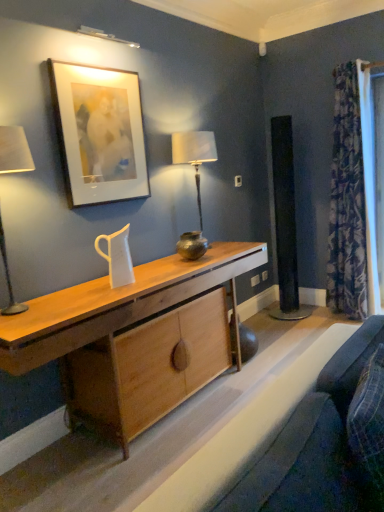
Measure the distance between matte white picture frame at upper left and camera.

matte white picture frame at upper left is 2.30 meters from camera.

The height and width of the screenshot is (512, 384). What do you see at coordinates (192, 245) in the screenshot?
I see `shiny metallic vase at center` at bounding box center [192, 245].

Find the location of `velvet blue swivel chair at lower right, the 2th swivel chair viewed from the right`. velvet blue swivel chair at lower right, the 2th swivel chair viewed from the right is located at coordinates (317, 446).

Describe the element at coordinates (347, 202) in the screenshot. I see `patterned fabric curtain at right` at that location.

What is the approximate width of natural wood desk at center?

It is 51.32 centimeters.

Describe the element at coordinates (361, 401) in the screenshot. I see `velvet blue cushion at lower right, the 2th swivel chair when ordered from left to right` at that location.

In order to click on metallic silver table lamp at center in this screenshot , I will do `click(195, 181)`.

Is velvet blue cushion at lower right, the 2th swivel chair when ordered from left to right, aimed at matte white picture frame at upper left?

No, velvet blue cushion at lower right, the 2th swivel chair when ordered from left to right, is not oriented towards matte white picture frame at upper left.

Does point (336, 358) appear closer or farther from the camera than point (114, 94)?

Clearly, point (336, 358) is closer to the camera than point (114, 94).

Between velvet blue cushion at lower right, the 2th swivel chair when ordered from left to right, and matte white picture frame at upper left, which one appears on the right side from the viewer's perspective?

velvet blue cushion at lower right, the 2th swivel chair when ordered from left to right.

Is velvet blue cushion at lower right, placed as the first swivel chair when sorted from right to left, bigger than matte white picture frame at upper left?

Indeed, velvet blue cushion at lower right, placed as the first swivel chair when sorted from right to left, has a larger size compared to matte white picture frame at upper left.

Find the location of a particular element. The width and height of the screenshot is (384, 512). table lamp above the velvet blue cushion at lower right, the 2th swivel chair when ordered from left to right (from the image's perspective) is located at coordinates (195, 181).

Which of these two, velvet blue cushion at lower right, the 2th swivel chair when ordered from left to right, or metallic silver table lamp at center, is wider?

metallic silver table lamp at center is wider.

From a real-world perspective, who is located higher, velvet blue cushion at lower right, placed as the first swivel chair when sorted from right to left, or metallic silver table lamp at center?

metallic silver table lamp at center, from a real-world perspective.

From the image's perspective, relative to natural wood desk at center, is patterned fabric curtain at right above or below?

Based on their image positions, patterned fabric curtain at right is located above natural wood desk at center.

How many degrees apart are the facing directions of patterned fabric curtain at right and natural wood desk at center?

The facing directions of patterned fabric curtain at right and natural wood desk at center are 89.5 degrees apart.

From their relative heights in the image, would you say patterned fabric curtain at right is taller or shorter than natural wood desk at center?

Considering their sizes, patterned fabric curtain at right has more height than natural wood desk at center.

From a real-world perspective, who is located higher, patterned fabric curtain at right or natural wood desk at center?

patterned fabric curtain at right.

Is shiny metallic vase at center positioned with its back to matte white picture frame at upper left?

That's not correct — shiny metallic vase at center is not looking away from matte white picture frame at upper left.

Which object is thinner, shiny metallic vase at center or matte white picture frame at upper left?

Thinner between the two is matte white picture frame at upper left.

Is shiny metallic vase at center positioned behind matte white picture frame at upper left?

Yes, it is.

From the image's perspective, count 1st swivel chairs downward from the natural wood desk at center and point to it. Please provide its 2D coordinates.

[(361, 401)]

Is velvet blue cushion at lower right, placed as the first swivel chair when sorted from right to left, oriented towards natural wood desk at center?

No, velvet blue cushion at lower right, placed as the first swivel chair when sorted from right to left, does not turn towards natural wood desk at center.

Based on their sizes in the image, would you say velvet blue cushion at lower right, the 2th swivel chair when ordered from left to right, is bigger or smaller than natural wood desk at center?

Clearly, velvet blue cushion at lower right, the 2th swivel chair when ordered from left to right, is smaller in size than natural wood desk at center.

Between velvet blue cushion at lower right, placed as the first swivel chair when sorted from right to left, and natural wood desk at center, which one appears on the right side from the viewer's perspective?

velvet blue cushion at lower right, placed as the first swivel chair when sorted from right to left, is more to the right.

What are the coordinates of `swivel chair below the velvet blue cushion at lower right, the 2th swivel chair when ordered from left to right (from a real-world perspective)` in the screenshot? It's located at (317, 446).

From the picture: Is the depth of velvet blue cushion at lower right, placed as the first swivel chair when sorted from right to left, less than that of velvet blue swivel chair at lower right, positioned as the 1th swivel chair in left-to-right order?

No, it is behind velvet blue swivel chair at lower right, positioned as the 1th swivel chair in left-to-right order.

From the image's perspective, is velvet blue cushion at lower right, the 2th swivel chair when ordered from left to right, under velvet blue swivel chair at lower right, positioned as the 1th swivel chair in left-to-right order?

Actually, velvet blue cushion at lower right, the 2th swivel chair when ordered from left to right, appears above velvet blue swivel chair at lower right, positioned as the 1th swivel chair in left-to-right order, in the image.

Considering the sizes of objects velvet blue swivel chair at lower right, the 2th swivel chair viewed from the right, and matte white picture frame at upper left in the image provided, who is wider, velvet blue swivel chair at lower right, the 2th swivel chair viewed from the right, or matte white picture frame at upper left?

Wider between the two is velvet blue swivel chair at lower right, the 2th swivel chair viewed from the right.

Is velvet blue swivel chair at lower right, positioned as the 1th swivel chair in left-to-right order, smaller than matte white picture frame at upper left?

Actually, velvet blue swivel chair at lower right, positioned as the 1th swivel chair in left-to-right order, might be larger than matte white picture frame at upper left.

This screenshot has width=384, height=512. Identify the location of the 1st swivel chair to the right of the matte white picture frame at upper left, starting your count from the anchor. (317, 446).

From the image's perspective, count 1st swivel chairs downward from the matte white picture frame at upper left and point to it. Please provide its 2D coordinates.

[(361, 401)]

Locate an element on the screen. The width and height of the screenshot is (384, 512). table lamp behind the velvet blue cushion at lower right, placed as the first swivel chair when sorted from right to left is located at coordinates (195, 181).

Considering their positions, is natural wood desk at center positioned closer to velvet blue swivel chair at lower right, positioned as the 1th swivel chair in left-to-right order, than matte white picture frame at upper left?

The object closer to velvet blue swivel chair at lower right, positioned as the 1th swivel chair in left-to-right order, is natural wood desk at center.

From the picture: When comparing their distances from natural wood desk at center, does velvet blue swivel chair at lower right, the 2th swivel chair viewed from the right, or metallic silver table lamp at center seem further?

velvet blue swivel chair at lower right, the 2th swivel chair viewed from the right, is further to natural wood desk at center.

Looking at the image, which one is located further to metallic silver table lamp at center, natural wood desk at center or matte white picture frame at upper left?

natural wood desk at center is positioned further to the anchor metallic silver table lamp at center.

When comparing their distances from velvet blue swivel chair at lower right, the 2th swivel chair viewed from the right, does matte white picture frame at upper left or metallic silver table lamp at center seem closer?

matte white picture frame at upper left lies closer to velvet blue swivel chair at lower right, the 2th swivel chair viewed from the right, than the other object.

Looking at this image, which object lies nearer to the anchor point metallic silver table lamp at center, velvet blue swivel chair at lower right, positioned as the 1th swivel chair in left-to-right order, or natural wood desk at center?

The object closer to metallic silver table lamp at center is natural wood desk at center.

Estimate the real-world distances between objects in this image. Which object is further from natural wood desk at center, metallic silver table lamp at center or velvet blue swivel chair at lower right, the 2th swivel chair viewed from the right?

velvet blue swivel chair at lower right, the 2th swivel chair viewed from the right, is positioned further to the anchor natural wood desk at center.

When comparing their distances from patterned fabric curtain at right, does velvet blue cushion at lower right, the 2th swivel chair when ordered from left to right, or natural wood desk at center seem further?

Based on the image, velvet blue cushion at lower right, the 2th swivel chair when ordered from left to right, appears to be further to patterned fabric curtain at right.

From the picture: From the image, which object appears to be nearer to shiny metallic vase at center, velvet blue cushion at lower right, the 2th swivel chair when ordered from left to right, or patterned fabric curtain at right?

The object closer to shiny metallic vase at center is velvet blue cushion at lower right, the 2th swivel chair when ordered from left to right.

Find the location of a particular element. The image size is (384, 512). table lamp between natural wood desk at center and patterned fabric curtain at right from left to right is located at coordinates (195, 181).

Where is `vase between velvet blue cushion at lower right, the 2th swivel chair when ordered from left to right, and metallic silver table lamp at center from front to back`? The image size is (384, 512). vase between velvet blue cushion at lower right, the 2th swivel chair when ordered from left to right, and metallic silver table lamp at center from front to back is located at coordinates (192, 245).

I want to click on swivel chair between velvet blue swivel chair at lower right, the 2th swivel chair viewed from the right, and metallic silver table lamp at center from front to back, so click(361, 401).

The width and height of the screenshot is (384, 512). Identify the location of swivel chair positioned between velvet blue swivel chair at lower right, the 2th swivel chair viewed from the right, and natural wood desk at center from near to far. (361, 401).